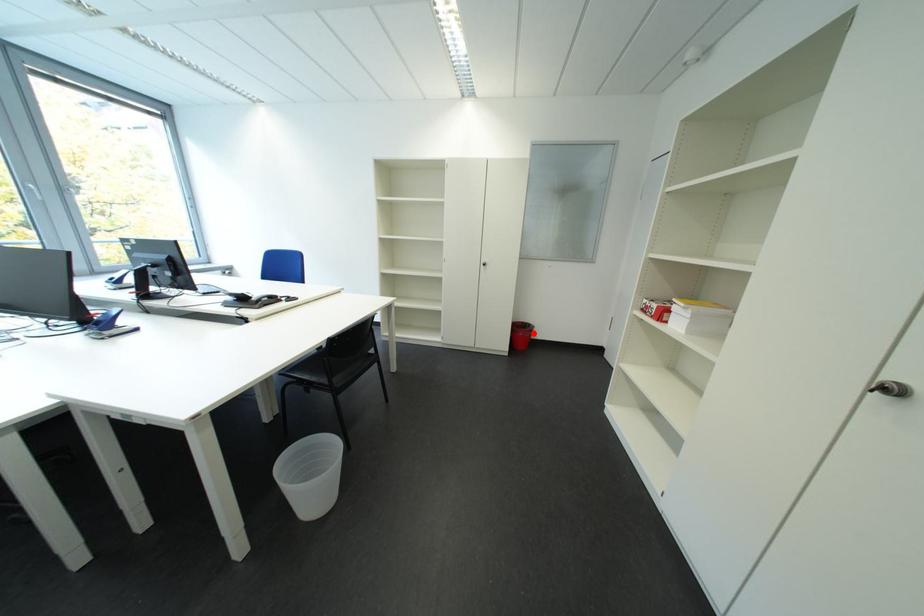
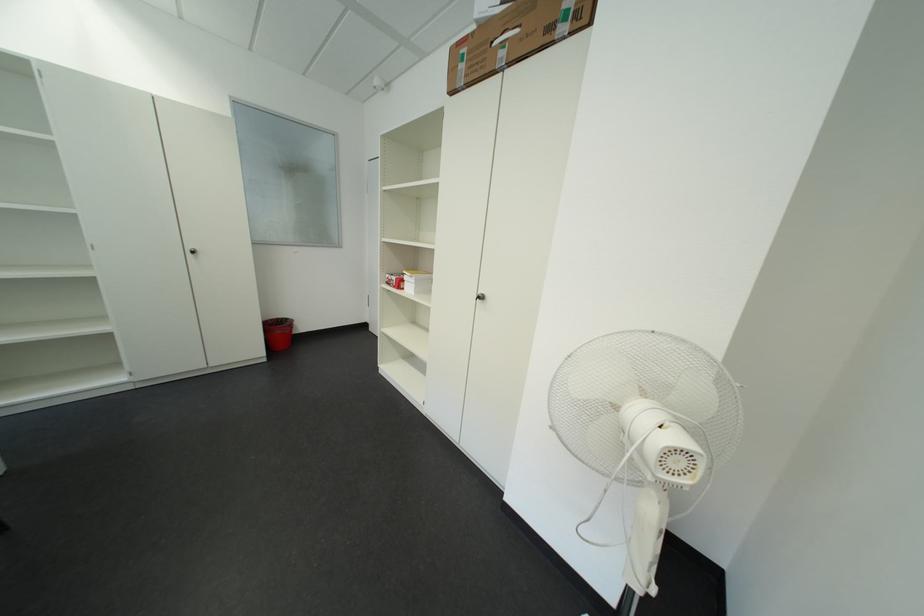
Question: A red point is marked in image1. In image2, is the corresponding 3D point closer to the camera or farther? Reply with the corresponding letter.

Choices:
 (A) The corresponding 3D point is closer.
 (B) The corresponding 3D point is farther.

Answer: (A)